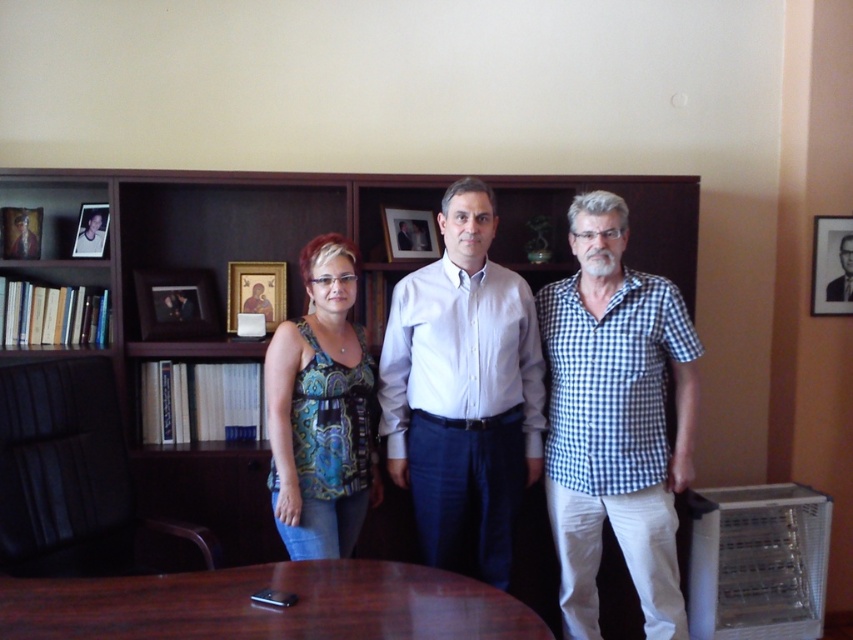
You are a photographer trying to capture a clear shot of the patterned fabric top at center and the wooden picture frame at left. Which object will appear closer to the camera in the photo?

The patterned fabric top at center will appear closer to the camera because it is in front of the wooden picture frame at left.

You are a photographer trying to capture a clear shot of the patterned fabric top at center and the black matte picture frame at upper right. Which object will appear closer to the camera in the photo?

The patterned fabric top at center will appear closer to the camera because it is in front of the black matte picture frame at upper right.